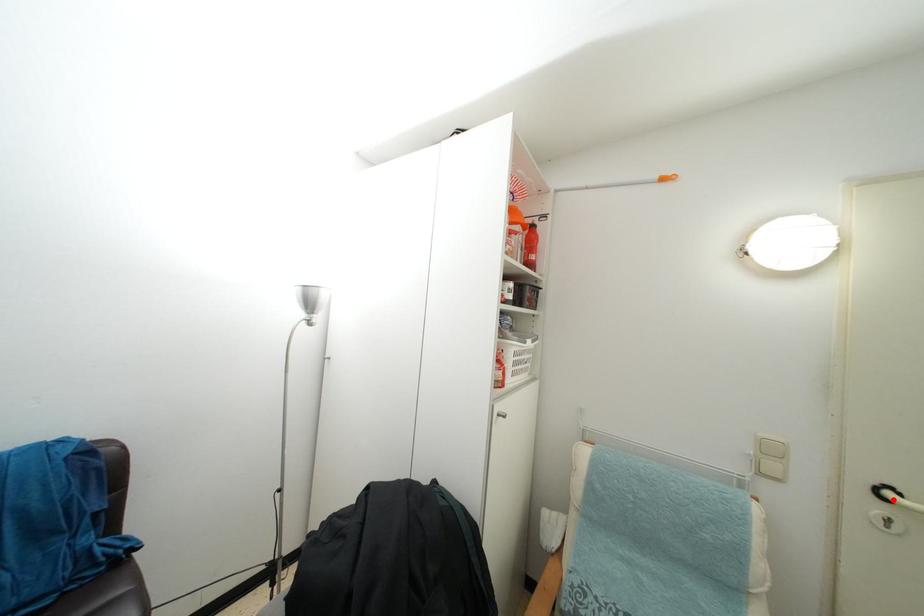
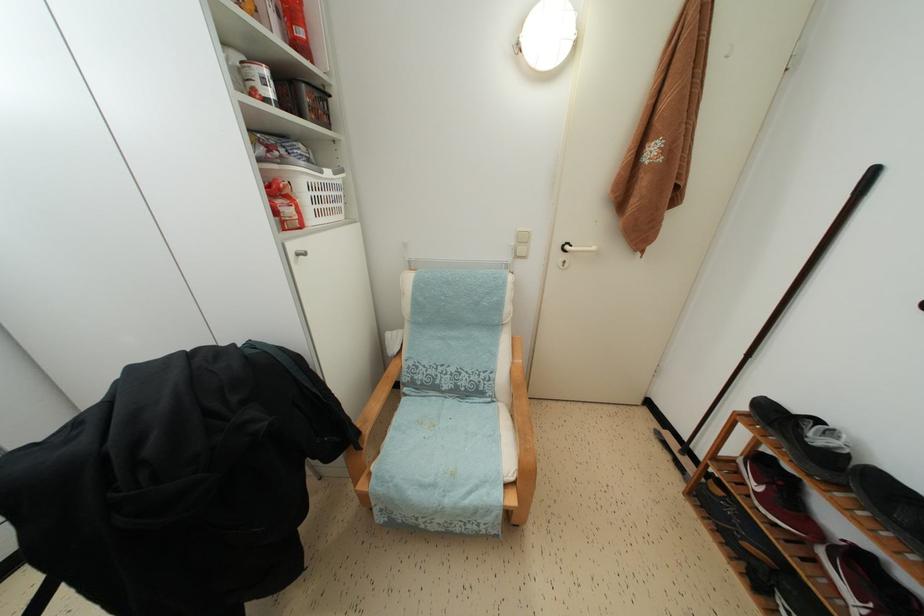
Find the pixel in the second image that matches the highlighted location in the first image.

(572, 253)